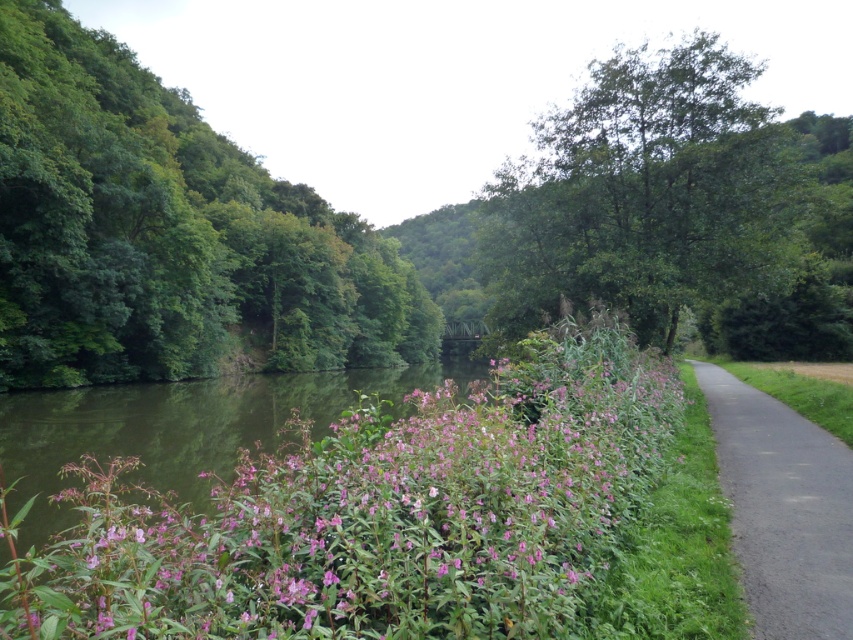
You are a hiker who wants to cross the river to reach a cabin on the other side. You have a 150 feet long rope. Can you use the pink matte flowers at center and the green leafy tree at left to secure the rope for crossing?

The pink matte flowers at center and green leafy tree at left are 164.47 feet apart. Since the rope is only 150 feet long, it is not long enough to span the distance between them. Therefore, you cannot secure the rope between these two points.

You are a hiker who wants to pick some pink matte flowers at center. The black asphalt road at right is blocking your path. Can you walk around the road to reach the flowers?

The pink matte flowers at center is positioned under the black asphalt road at right, so you cannot walk around the road to reach the flowers because the road is above them.

Consider the image. You are a hiker who wants to take a photo of the pink matte flowers at center and the green leafy tree at upper center. Which object should you focus on first if you want to capture both in a single frame without moving your camera?

You should focus on the pink matte flowers at center first because their width is larger than the green leafy tree at upper center, so they will occupy more space in the frame. By centering the flowers, you can adjust the camera to include the tree while keeping the composition balanced.